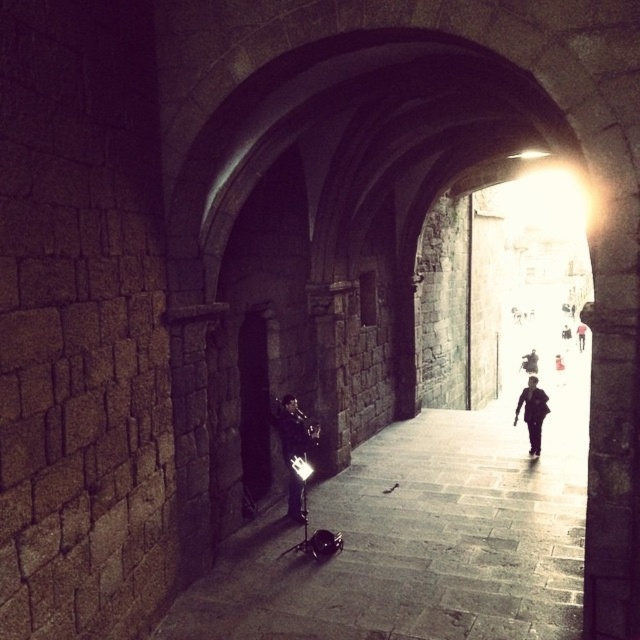
Is black matte jacket at center below dark blue jeans at right?

Correct, black matte jacket at center is located below dark blue jeans at right.

Is black matte jacket at center thinner than dark blue jeans at right?

No.

Is point (532, 436) closer to camera compared to point (580, 332)?

Yes, point (532, 436) is closer to viewer.

I want to click on black matte jacket at center, so click(532, 412).

Can you confirm if shiny black jacket at lower center is smaller than dark blue jeans at right?

Indeed, shiny black jacket at lower center has a smaller size compared to dark blue jeans at right.

Between point (296, 410) and point (579, 324), which one is positioned behind?

The point (579, 324) is more distant.

Locate an element on the screen. shiny black jacket at lower center is located at coordinates (294, 448).

This screenshot has width=640, height=640. What are the coordinates of `shiny black jacket at lower center` in the screenshot? It's located at pyautogui.click(x=294, y=448).

Who is shorter, shiny black jacket at lower center or dark gray suit at center?

dark gray suit at center

In the scene shown: Is the position of shiny black jacket at lower center less distant than that of dark gray suit at center?

Yes.

Describe the element at coordinates (294, 448) in the screenshot. I see `shiny black jacket at lower center` at that location.

Where is `shiny black jacket at lower center`? shiny black jacket at lower center is located at coordinates (294, 448).